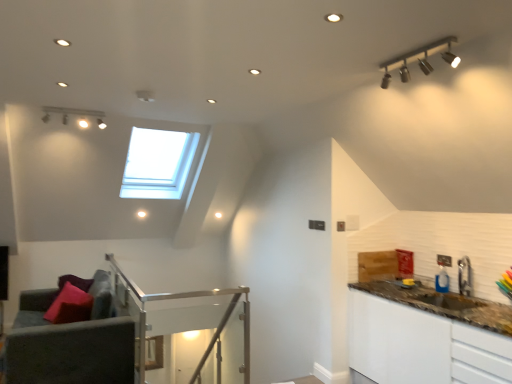
Question: Is brown granite countertop at right to the left or to the right of velvet purple couch at lower left in the image?

Choices:
 (A) right
 (B) left

Answer: (A)

Question: Considering the positions of brown granite countertop at right and velvet purple couch at lower left in the image, is brown granite countertop at right bigger or smaller than velvet purple couch at lower left?

Choices:
 (A) big
 (B) small

Answer: (A)

Question: Based on their relative distances, which object is nearer to the brown granite countertop at right?

Choices:
 (A) matte pink pillow at lower left
 (B) metallic silver faucet at right
 (C) clear glass balustrade at center
 (D) velvet purple couch at lower left
 (E) matte silver track lights at upper right

Answer: (B)

Question: Which is nearer to the matte pink pillow at lower left?

Choices:
 (A) metallic silver faucet at right
 (B) clear glass balustrade at center
 (C) velvet grey armchair at lower left
 (D) matte silver track lights at upper right
 (E) brown granite countertop at right

Answer: (C)